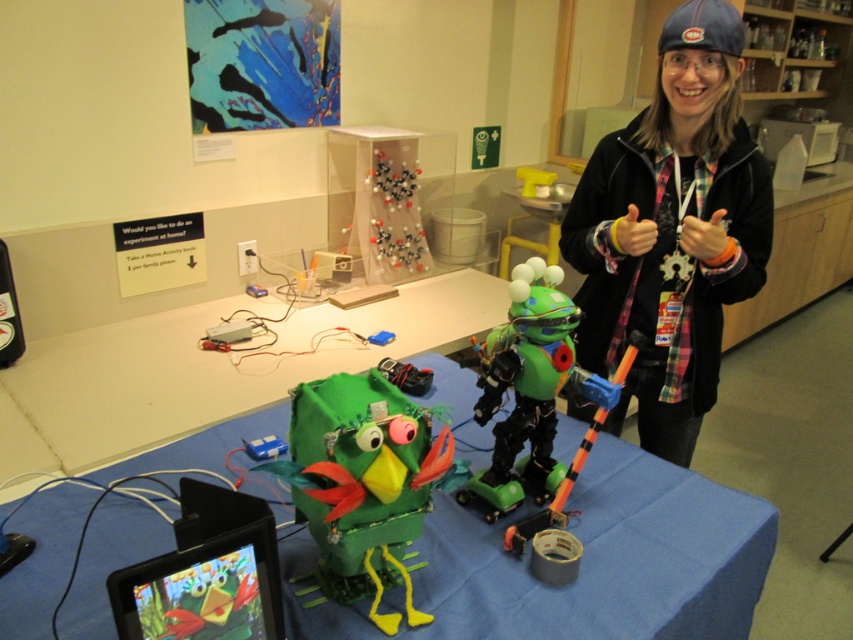
Question: Can you confirm if plaid flannel shirt at center is positioned to the right of green matte robot at center?

Choices:
 (A) no
 (B) yes

Answer: (B)

Question: Is green cardboard table at center positioned before green matte robot at center?

Choices:
 (A) yes
 (B) no

Answer: (A)

Question: Does green cardboard table at center have a lesser width compared to green cardboard bird at center?

Choices:
 (A) no
 (B) yes

Answer: (A)

Question: Estimate the real-world distances between objects in this image. Which object is farther from the green cardboard table at center?

Choices:
 (A) green cardboard bird at center
 (B) plaid flannel shirt at center

Answer: (B)

Question: Which point is closer to the camera?

Choices:
 (A) plaid flannel shirt at center
 (B) green cardboard bird at center
 (C) green matte robot at center
 (D) green cardboard table at center

Answer: (B)

Question: Which object is closer to the camera taking this photo?

Choices:
 (A) plaid flannel shirt at center
 (B) green matte robot at center
 (C) green cardboard bird at center

Answer: (C)